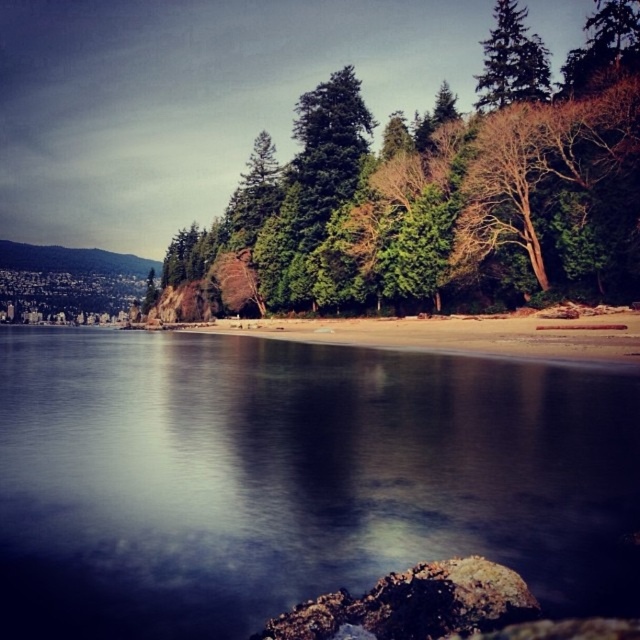
Question: Which point appears farthest from the camera in this image?

Choices:
 (A) (400, 541)
 (B) (525, 333)

Answer: (B)

Question: Which point is farther to the camera?

Choices:
 (A) brown sand at center
 (B) rusty metallic rock at lower center
 (C) smooth dark water at center

Answer: (A)

Question: Is rusty metallic rock at lower center closer to the viewer compared to green matte tree at upper right?

Choices:
 (A) no
 (B) yes

Answer: (B)

Question: Which object is the closest to the green matte tree at upper right?

Choices:
 (A) brown sand at center
 (B) rusty metallic rock at lower center
 (C) green textured tree at center
 (D) smooth dark water at center

Answer: (A)

Question: Can you confirm if rusty metallic rock at lower center is thinner than green matte tree at upper right?

Choices:
 (A) no
 (B) yes

Answer: (B)

Question: Observing the image, what is the correct spatial positioning of smooth dark water at center in reference to brown sand at center?

Choices:
 (A) left
 (B) right

Answer: (A)